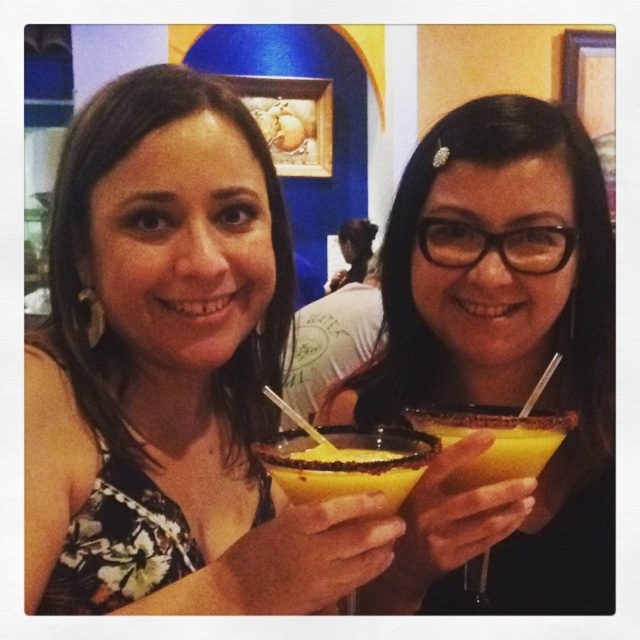
Which is in front, point (312, 520) or point (276, 483)?

Positioned in front is point (312, 520).

Is matte black cocktail glass at center smaller than yellow liquid at center?

Incorrect, matte black cocktail glass at center is not smaller in size than yellow liquid at center.

The height and width of the screenshot is (640, 640). In order to click on matte black cocktail glass at center in this screenshot , I will do `click(172, 369)`.

Does point (61, 253) come in front of point (516, 470)?

That is False.

Which of these two, matte black cocktail glass at center or yellowcrushed icecocktail at right, stands shorter?

With less height is yellowcrushed icecocktail at right.

Which is behind, point (221, 188) or point (474, 605)?

The point (474, 605) is behind.

Where is `matte black cocktail glass at center`? The image size is (640, 640). matte black cocktail glass at center is located at coordinates tap(172, 369).

Does point (268, 452) come closer to viewer compared to point (499, 417)?

Yes, it is.

Can you confirm if yellow liquid at center is wider than yellowcrushed icecocktail at right?

In fact, yellow liquid at center might be narrower than yellowcrushed icecocktail at right.

This screenshot has height=640, width=640. I want to click on yellow liquid at center, so click(348, 461).